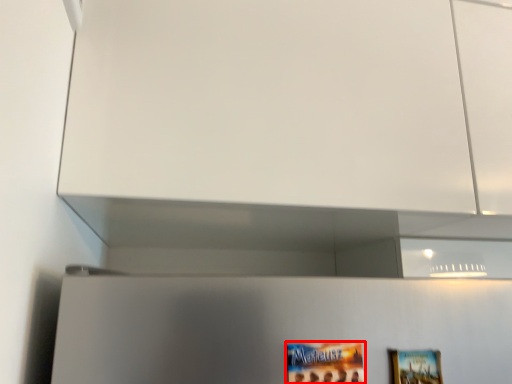
Question: From the image's perspective, considering the relative positions of movie poster (annotated by the red box) and picture frame in the image provided, where is movie poster (annotated by the red box) located with respect to the staircase?

Choices:
 (A) below
 (B) above

Answer: (B)